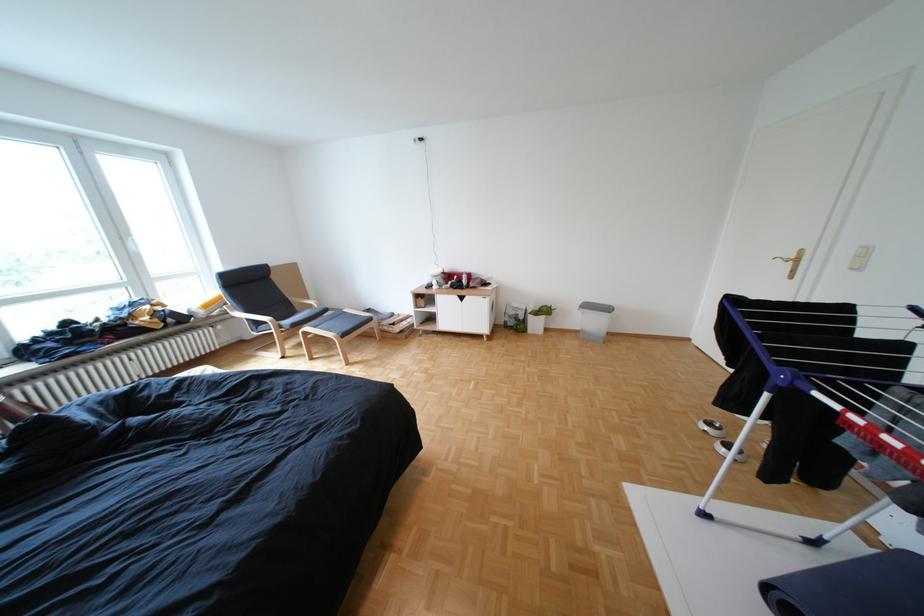
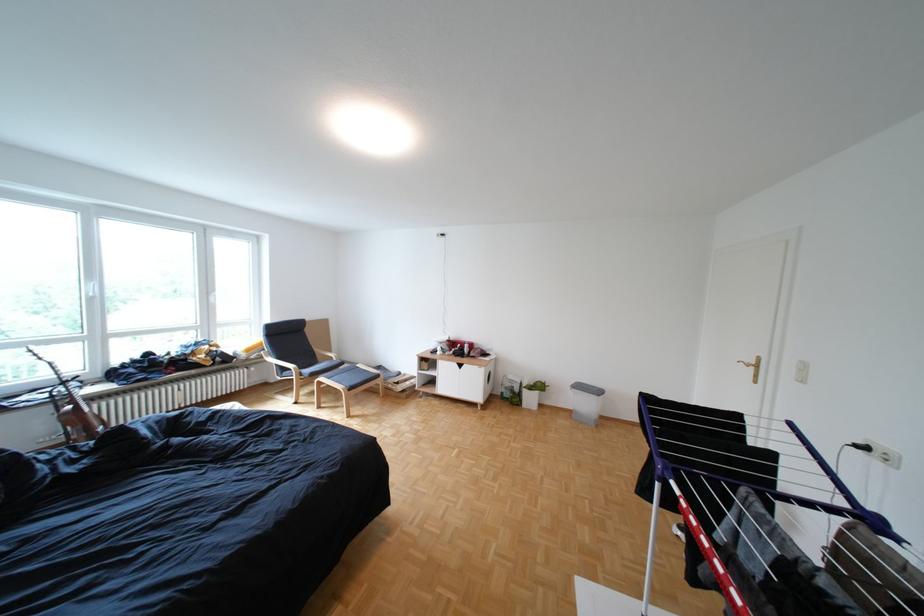
In a continuous first-person perspective shot, in which direction is the camera moving?

The cameraman walked toward right, backward.